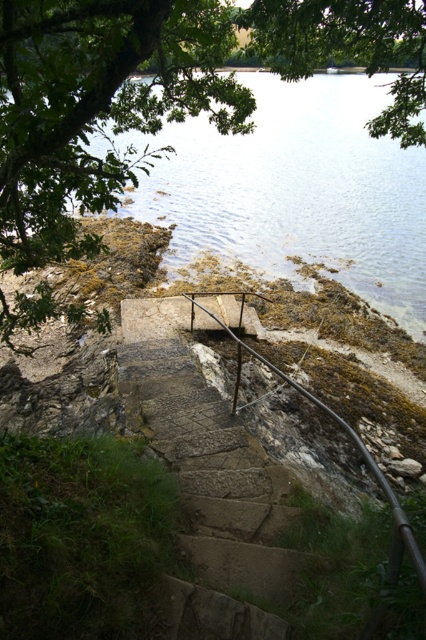
Does green leafy tree at upper left appear over rustic stone stairs at center?

Indeed, green leafy tree at upper left is positioned over rustic stone stairs at center.

Between green leafy tree at upper left and rustic stone stairs at center, which one has more height?

green leafy tree at upper left is taller.

You are a GUI agent. You are given a task and a screenshot of the screen. Output one action in this format:
    pyautogui.click(x=<x>, y=<y>)
    Task: Click on the green leafy tree at upper left
    The width and height of the screenshot is (426, 640).
    Given the screenshot: What is the action you would take?
    pyautogui.click(x=160, y=90)

Which is in front, point (377, 28) or point (224, 326)?

Point (224, 326) is in front.

Locate an element on the screen. This screenshot has height=640, width=426. green leafy tree at upper center is located at coordinates (348, 49).

Image resolution: width=426 pixels, height=640 pixels. Describe the element at coordinates (160, 90) in the screenshot. I see `green leafy tree at upper left` at that location.

Can you confirm if green leafy tree at upper left is smaller than green leafy tree at upper center?

Incorrect, green leafy tree at upper left is not smaller in size than green leafy tree at upper center.

Is point (230, 45) behind point (256, 28)?

Yes.

This screenshot has width=426, height=640. In order to click on green leafy tree at upper left in this screenshot , I will do `click(160, 90)`.